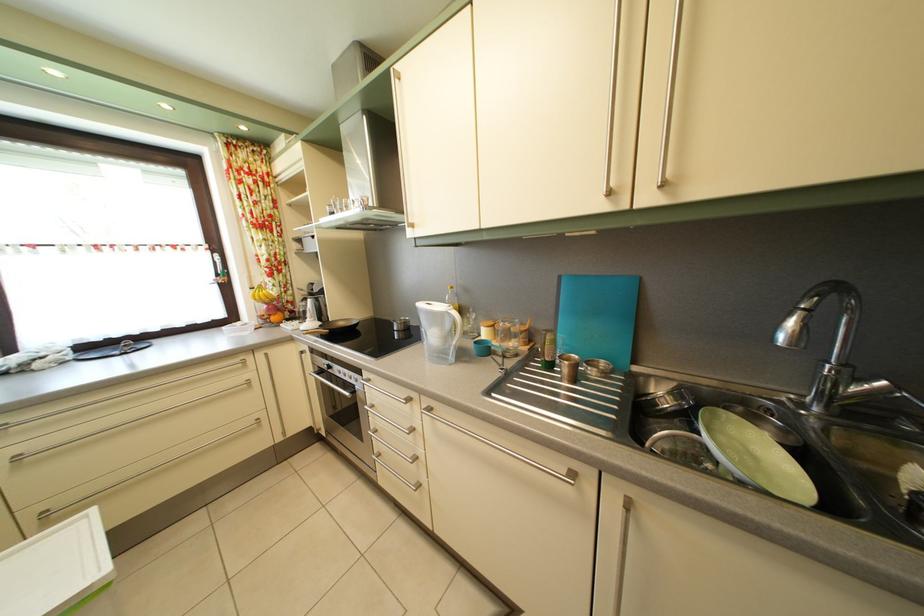
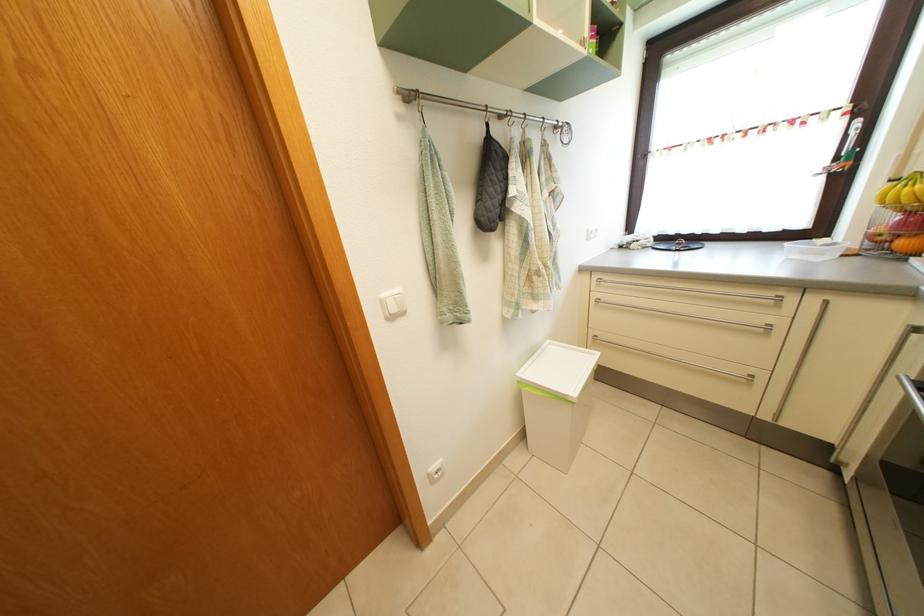
In the second image, find the point that corresponds to (x=283, y=326) in the first image.

(910, 252)